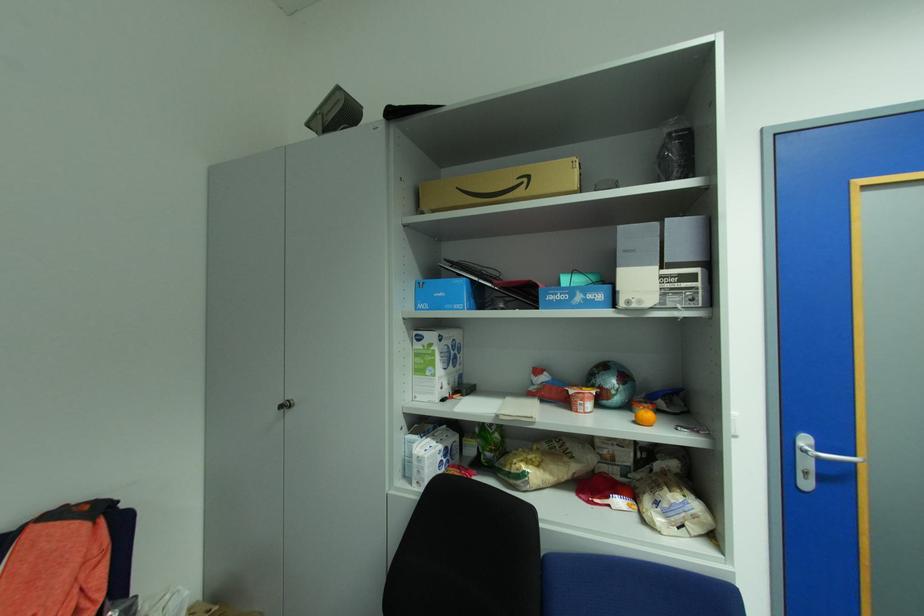
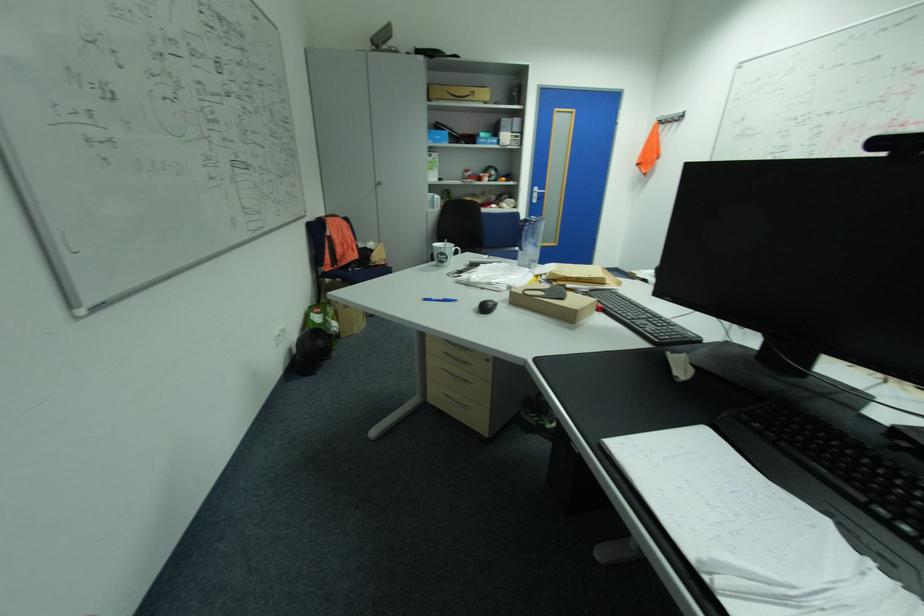
Locate, in the second image, the point that corresponds to point 830,460 in the first image.

(544, 193)